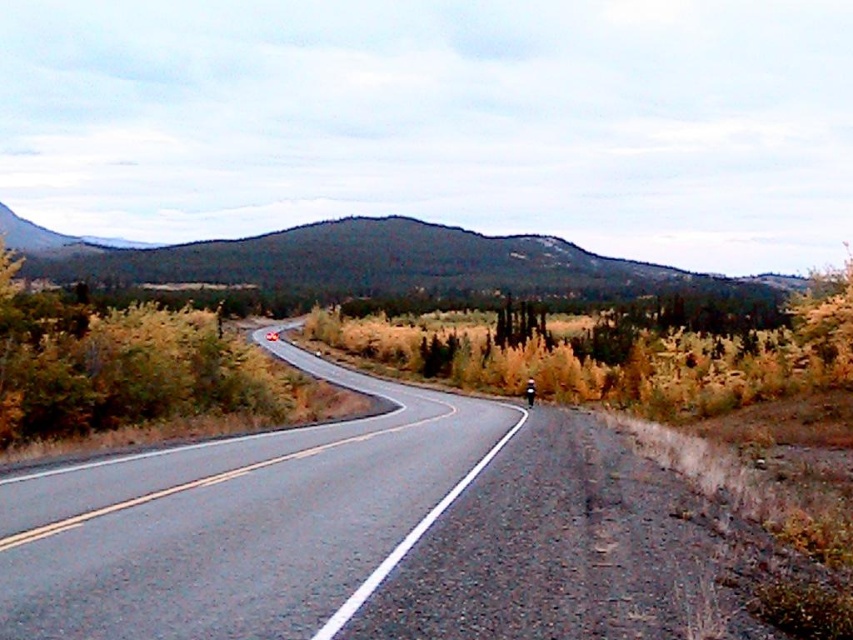
Question: Is the position of green forested mountain at upper center more distant than that of green leafy shrub at left?

Choices:
 (A) yes
 (B) no

Answer: (A)

Question: Can you confirm if asphalt road at center is wider than green leafy shrub at left?

Choices:
 (A) yes
 (B) no

Answer: (B)

Question: Among these objects, which one is nearest to the camera?

Choices:
 (A) green forested mountain at upper center
 (B) green leafy shrub at left

Answer: (B)

Question: Which of the following is the farthest from the observer?

Choices:
 (A) (21, 419)
 (B) (553, 280)

Answer: (B)

Question: Is green forested mountain at upper center bigger than green leafy shrub at left?

Choices:
 (A) yes
 (B) no

Answer: (A)

Question: Which of the following is the farthest from the observer?

Choices:
 (A) (344, 237)
 (B) (166, 316)

Answer: (A)